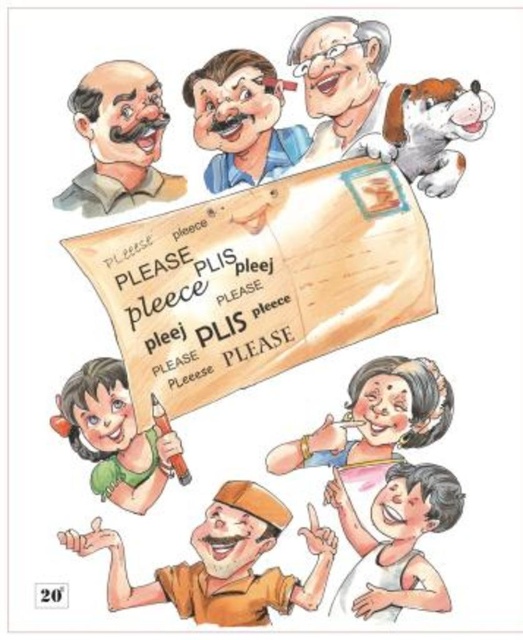
You are an artist trying to paint the scene. You need to decide the size of the wooden sign at center and the brown textured shirt at upper left. Which object should be painted larger?

The wooden sign at center should be painted larger because its width is larger than the brown textured shirt at upper left.

You are a fashion designer observing the scene. You notice the matte blue shirt at center and the matte pink handbag at lower center. Which object is positioned to the right side of the other?

The matte blue shirt at center is to the left of the matte pink handbag at lower center, so the matte pink handbag at lower center is positioned to the right side of the matte blue shirt at center.

You are a person who wants to carry both the matte pink handbag at lower center and the matte green pencil at lower left. Which item can you hold in one hand more easily?

The matte green pencil at lower left can be held in one hand more easily since it is smaller in size compared to the matte pink handbag at lower center.